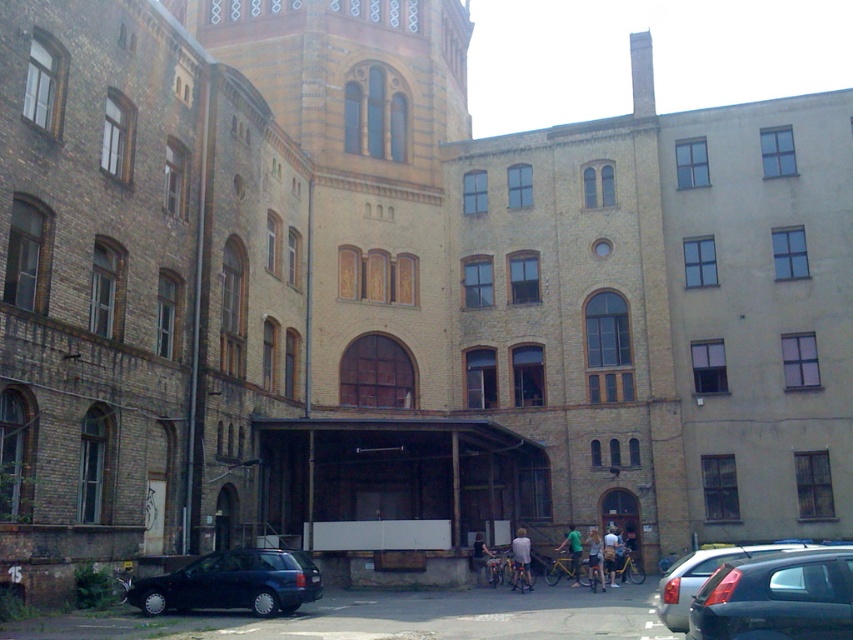
Question: Among these objects, which one is nearest to the camera?

Choices:
 (A) matte black car at lower left
 (B) light blue fabric shirt at center
 (C) light blue jeans at center

Answer: (A)

Question: Among these objects, which one is nearest to the camera?

Choices:
 (A) light blue fabric shirt at center
 (B) light brown leather jacket at center

Answer: (A)

Question: Among these points, which one is farthest from the camera?

Choices:
 (A) (590, 547)
 (B) (479, 566)
 (C) (521, 548)

Answer: (A)

Question: Can you confirm if black matte car at lower right is thinner than light blue fabric shirt at center?

Choices:
 (A) yes
 (B) no

Answer: (B)

Question: Can you confirm if black matte car at lower right is smaller than light brown leather jacket at center?

Choices:
 (A) yes
 (B) no

Answer: (B)

Question: Does black matte car at lower right have a larger size compared to light blue denim shorts at center?

Choices:
 (A) yes
 (B) no

Answer: (A)